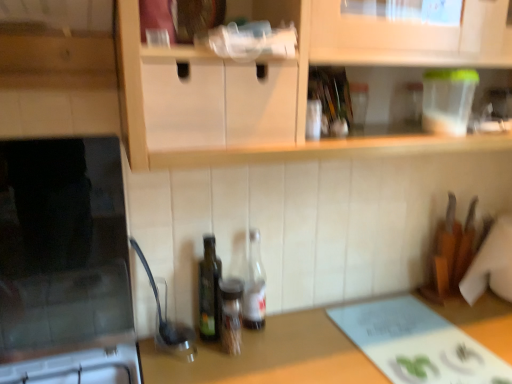
At what (x,y) coordinates should I click in order to perform the action: click on green glass bottle at center, which is counted as the first bottle, starting from the left. Please return your answer as a coordinate pair (x, y). This screenshot has height=384, width=512. Looking at the image, I should click on (209, 291).

The image size is (512, 384). Find the location of `translucent glass spice jar at center, which is the second bottle in left-to-right order`. translucent glass spice jar at center, which is the second bottle in left-to-right order is located at coordinates (231, 314).

Locate an element on the screen. The image size is (512, 384). green glass bottle at center, arranged as the third bottle when viewed from the right is located at coordinates (209, 291).

From a real-world perspective, which is physically below, green glass bottle at center, which is counted as the first bottle, starting from the left, or translucent glass bottle at center, the first bottle when ordered from right to left?

translucent glass bottle at center, the first bottle when ordered from right to left.

Who is smaller, green glass bottle at center, arranged as the third bottle when viewed from the right, or translucent glass bottle at center, the first bottle when ordered from right to left?

Smaller between the two is translucent glass bottle at center, the first bottle when ordered from right to left.

Does green glass bottle at center, arranged as the third bottle when viewed from the right, have a greater width compared to translucent glass bottle at center, which appears as the 3th bottle when viewed from the left?

In fact, green glass bottle at center, arranged as the third bottle when viewed from the right, might be narrower than translucent glass bottle at center, which appears as the 3th bottle when viewed from the left.

What's the angular difference between green glass bottle at center, which is counted as the first bottle, starting from the left, and translucent glass bottle at center, the first bottle when ordered from right to left,'s facing directions?

The angular difference between green glass bottle at center, which is counted as the first bottle, starting from the left, and translucent glass bottle at center, the first bottle when ordered from right to left, is 0.000843 degrees.

Is brown wooden countertop at center turned away from green glass bottle at center, which is counted as the first bottle, starting from the left?

That's not correct — brown wooden countertop at center is not looking away from green glass bottle at center, which is counted as the first bottle, starting from the left.

Between brown wooden countertop at center and green glass bottle at center, arranged as the third bottle when viewed from the right, which one appears on the right side from the viewer's perspective?

Positioned to the right is brown wooden countertop at center.

Is brown wooden countertop at center taller or shorter than green glass bottle at center, arranged as the third bottle when viewed from the right?

Clearly, brown wooden countertop at center is taller compared to green glass bottle at center, arranged as the third bottle when viewed from the right.

There is a brown wooden countertop at center. Where is `the 2nd bottle above it (from the image's perspective)`? the 2nd bottle above it (from the image's perspective) is located at coordinates (209, 291).

Is point (493, 341) closer or farther from the camera than point (62, 353)?

Point (493, 341) is farther from the camera than point (62, 353).

Is brown wooden countertop at center positioned with its back to black glass microwave at left?

No, brown wooden countertop at center's orientation is not away from black glass microwave at left.

From the image's perspective, which object appears higher, brown wooden countertop at center or black glass microwave at left?

black glass microwave at left is shown above in the image.

Considering the sizes of objects brown wooden countertop at center and black glass microwave at left in the image provided, who is thinner, brown wooden countertop at center or black glass microwave at left?

Thinner between the two is brown wooden countertop at center.

You are a GUI agent. You are given a task and a screenshot of the screen. Output one action in this format:
    pyautogui.click(x=<x>, y=<y>)
    Task: Click on the bottle that is the 2nd one when counting leftward from the brown wooden countertop at center
    Image resolution: width=512 pixels, height=384 pixels.
    Given the screenshot: What is the action you would take?
    pyautogui.click(x=231, y=314)

How different are the orientations of translucent glass spice jar at center, which is the second bottle in left-to-right order, and brown wooden countertop at center in degrees?

translucent glass spice jar at center, which is the second bottle in left-to-right order, and brown wooden countertop at center are facing 0.35 degrees away from each other.

Considering the sizes of objects translucent glass spice jar at center, which is the second bottle from right to left, and brown wooden countertop at center in the image provided, who is shorter, translucent glass spice jar at center, which is the second bottle from right to left, or brown wooden countertop at center?

translucent glass spice jar at center, which is the second bottle from right to left.

Between translucent glass spice jar at center, which is the second bottle in left-to-right order, and brown wooden countertop at center, which one has larger size?

Bigger between the two is brown wooden countertop at center.

Considering the relative sizes of brown wooden countertop at center and translucent glass spice jar at center, which is the second bottle from right to left, in the image provided, is brown wooden countertop at center shorter than translucent glass spice jar at center, which is the second bottle from right to left,?

Incorrect, the height of brown wooden countertop at center does not fall short of that of translucent glass spice jar at center, which is the second bottle from right to left.

In terms of size, does brown wooden countertop at center appear bigger or smaller than translucent glass spice jar at center, which is the second bottle from right to left?

Considering their sizes, brown wooden countertop at center takes up more space than translucent glass spice jar at center, which is the second bottle from right to left.

Considering the relative positions of brown wooden countertop at center and translucent glass spice jar at center, which is the second bottle from right to left, in the image provided, is brown wooden countertop at center to the left of translucent glass spice jar at center, which is the second bottle from right to left, from the viewer's perspective?

Incorrect, brown wooden countertop at center is not on the left side of translucent glass spice jar at center, which is the second bottle from right to left.

Considering the relative sizes of translucent glass bottle at center, the first bottle when ordered from right to left, and black glass microwave at left in the image provided, is translucent glass bottle at center, the first bottle when ordered from right to left, smaller than black glass microwave at left?

Yes, translucent glass bottle at center, the first bottle when ordered from right to left, is smaller than black glass microwave at left.

Is translucent glass bottle at center, the first bottle when ordered from right to left, at the right side of black glass microwave at left?

Indeed, translucent glass bottle at center, the first bottle when ordered from right to left, is positioned on the right side of black glass microwave at left.

This screenshot has width=512, height=384. I want to click on appliance below the translucent glass bottle at center, which appears as the 3th bottle when viewed from the left (from the image's perspective), so click(x=65, y=265).

Between translucent glass bottle at center, the first bottle when ordered from right to left, and green glass bottle at center, which is counted as the first bottle, starting from the left, which one has larger size?

green glass bottle at center, which is counted as the first bottle, starting from the left, is bigger.

Could you tell me if translucent glass bottle at center, which appears as the 3th bottle when viewed from the left, is facing green glass bottle at center, which is counted as the first bottle, starting from the left?

No, translucent glass bottle at center, which appears as the 3th bottle when viewed from the left, is not facing towards green glass bottle at center, which is counted as the first bottle, starting from the left.

Which is closer to the camera, (249,247) or (204,327)?

Point (249,247) is positioned farther from the camera compared to point (204,327).

Considering the relative positions of translucent glass bottle at center, the first bottle when ordered from right to left, and green glass bottle at center, which is counted as the first bottle, starting from the left, in the image provided, is translucent glass bottle at center, the first bottle when ordered from right to left, to the left or to the right of green glass bottle at center, which is counted as the first bottle, starting from the left,?

translucent glass bottle at center, the first bottle when ordered from right to left, is to the right of green glass bottle at center, which is counted as the first bottle, starting from the left.

In order to click on bottle that is behind the green glass bottle at center, arranged as the third bottle when viewed from the right in this screenshot , I will do `click(254, 286)`.

The width and height of the screenshot is (512, 384). What are the coordinates of `countertop on the right of the green glass bottle at center, arranged as the third bottle when viewed from the right` in the screenshot? It's located at (271, 356).

In the scene shown: From the image, which object appears to be nearer to translucent glass bottle at center, which appears as the 3th bottle when viewed from the left, green glass bottle at center, which is counted as the first bottle, starting from the left, or brown wooden countertop at center?

Among the two, green glass bottle at center, which is counted as the first bottle, starting from the left, is located nearer to translucent glass bottle at center, which appears as the 3th bottle when viewed from the left.

Considering their positions, is translucent glass spice jar at center, which is the second bottle in left-to-right order, positioned closer to brown wooden countertop at center than translucent glass bottle at center, which appears as the 3th bottle when viewed from the left?

Based on the image, translucent glass spice jar at center, which is the second bottle in left-to-right order, appears to be nearer to brown wooden countertop at center.

When comparing their distances from brown wooden countertop at center, does translucent glass bottle at center, which appears as the 3th bottle when viewed from the left, or green glass bottle at center, which is counted as the first bottle, starting from the left, seem closer?

translucent glass bottle at center, which appears as the 3th bottle when viewed from the left.

Considering their positions, is green glass bottle at center, which is counted as the first bottle, starting from the left, positioned further to brown wooden countertop at center than black glass microwave at left?

black glass microwave at left lies further to brown wooden countertop at center than the other object.

Consider the image. When comparing their distances from black glass microwave at left, does brown wooden countertop at center or translucent glass bottle at center, the first bottle when ordered from right to left, seem further?

translucent glass bottle at center, the first bottle when ordered from right to left.

In the scene shown: Considering their positions, is brown wooden countertop at center positioned further to translucent glass spice jar at center, which is the second bottle in left-to-right order, than green glass bottle at center, arranged as the third bottle when viewed from the right?

Among the two, brown wooden countertop at center is located further to translucent glass spice jar at center, which is the second bottle in left-to-right order.

From the image, which object appears to be nearer to brown wooden countertop at center, black glass microwave at left or green glass bottle at center, arranged as the third bottle when viewed from the right?

green glass bottle at center, arranged as the third bottle when viewed from the right.

Based on their spatial positions, is brown wooden countertop at center or green glass bottle at center, arranged as the third bottle when viewed from the right, closer to translucent glass bottle at center, the first bottle when ordered from right to left?

Among the two, green glass bottle at center, arranged as the third bottle when viewed from the right, is located nearer to translucent glass bottle at center, the first bottle when ordered from right to left.

At what (x,y) coordinates should I click in order to perform the action: click on bottle between green glass bottle at center, which is counted as the first bottle, starting from the left, and translucent glass bottle at center, which appears as the 3th bottle when viewed from the left, from left to right. Please return your answer as a coordinate pair (x, y). Looking at the image, I should click on (231, 314).

What are the coordinates of `bottle between translucent glass spice jar at center, which is the second bottle in left-to-right order, and brown wooden countertop at center from left to right` in the screenshot? It's located at (254, 286).

Where is `countertop located between black glass microwave at left and translucent glass bottle at center, the first bottle when ordered from right to left, in the depth direction`? countertop located between black glass microwave at left and translucent glass bottle at center, the first bottle when ordered from right to left, in the depth direction is located at coordinates (271, 356).

At what (x,y) coordinates should I click in order to perform the action: click on bottle positioned between black glass microwave at left and green glass bottle at center, which is counted as the first bottle, starting from the left, from near to far. Please return your answer as a coordinate pair (x, y). The image size is (512, 384). Looking at the image, I should click on (231, 314).